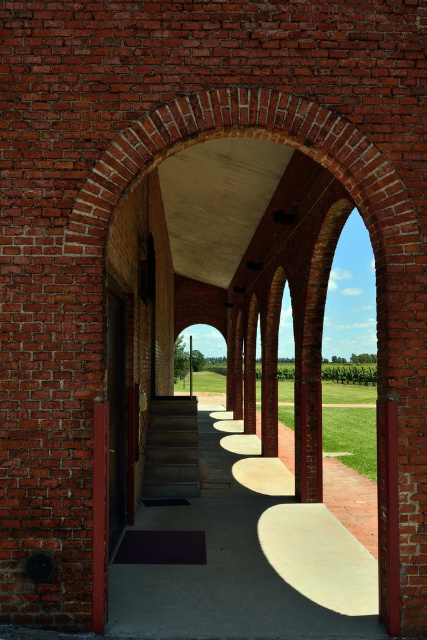
You are standing at the entrance of the brick arches and see the concrete sidewalk at center and the concrete stairs at center. Which one is positioned to the right side?

The concrete sidewalk at center is positioned to the right of the concrete stairs at center.